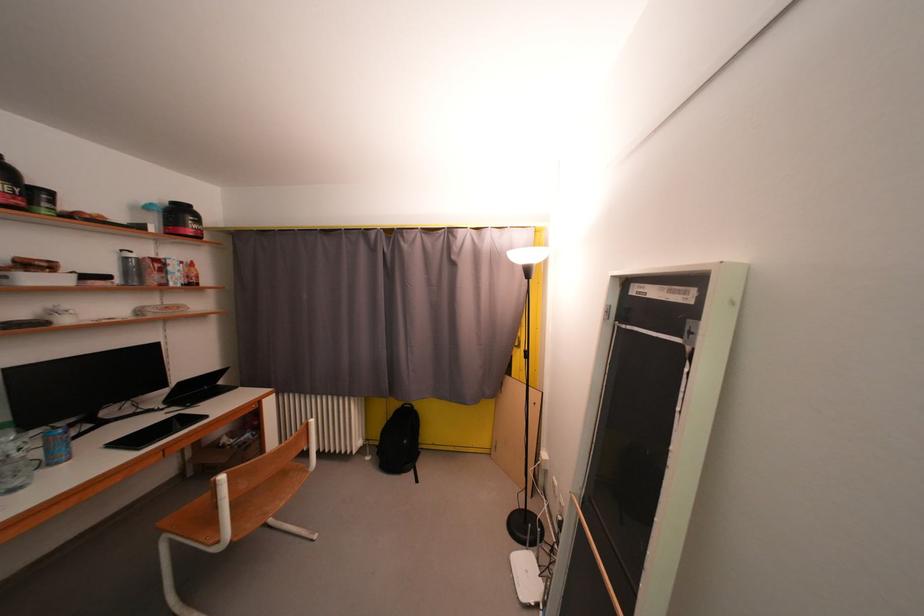
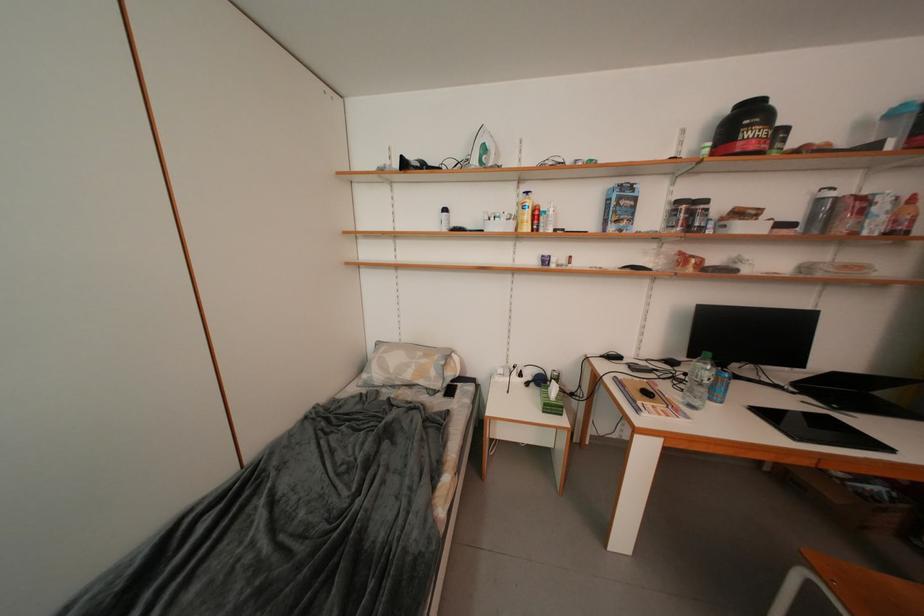
Question: The camera is either moving clockwise (left) or counter-clockwise (right) around the object. The first image is from the beginning of the video and the second image is from the end. Is the camera moving left or right when shooting the video?

Choices:
 (A) Left
 (B) Right

Answer: (B)